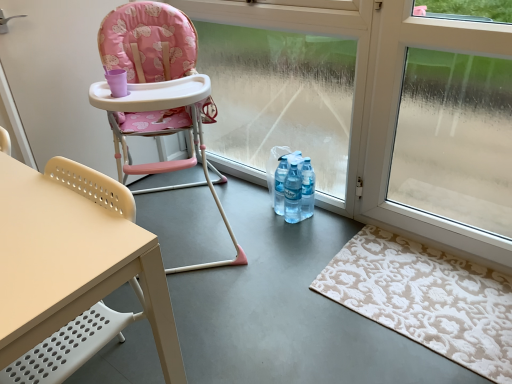
You are a GUI agent. You are given a task and a screenshot of the screen. Output one action in this format:
    pyautogui.click(x=<x>, y=<y>)
    Task: Click on the vacant area that lies between pink fabric highchair at left, the 1th chair when ordered from back to front, and beige textured rug at lower right
    Image resolution: width=512 pixels, height=384 pixels.
    Given the screenshot: What is the action you would take?
    pyautogui.click(x=288, y=274)